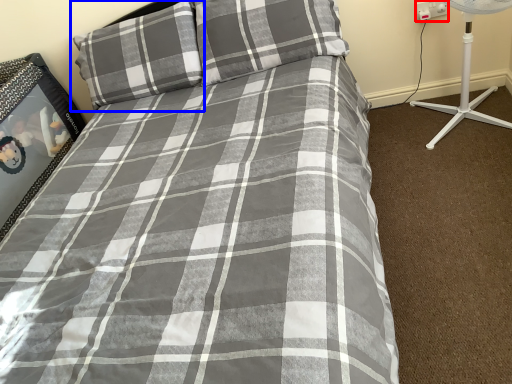
Question: Which object appears farthest to the camera in this image, electric outlet (highlighted by a red box) or pillow (highlighted by a blue box)?

Choices:
 (A) electric outlet
 (B) pillow

Answer: (A)